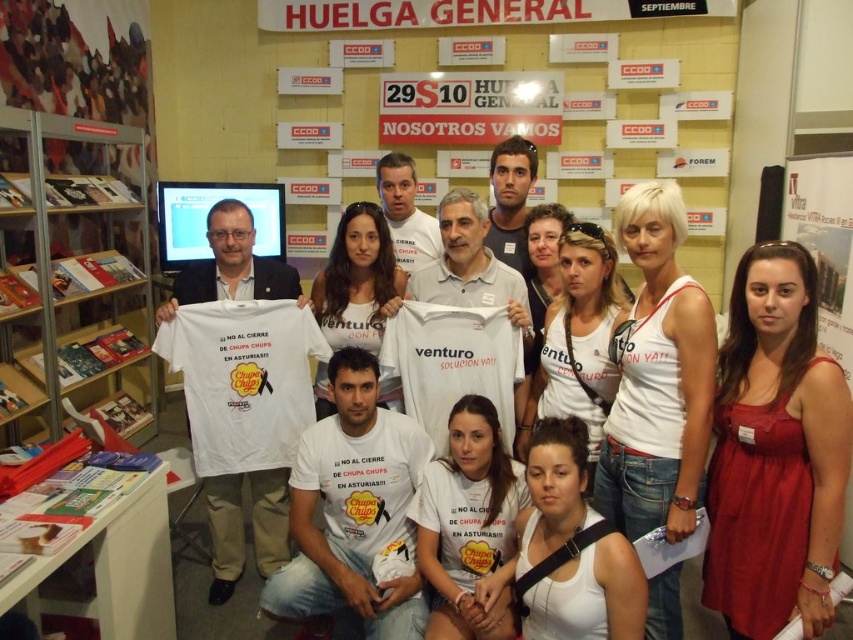
You are a photographer at this event and need to ensure that the metallic silver bookshelf at left is visible in the photo. Currently, the white cotton tank top at center is blocking it. Can you adjust the group to make the bookshelf visible without moving the bookshelf itself?

The white cotton tank top at center is in front of the metallic silver bookshelf at left, so moving the white cotton tank top at center backward or to the side would allow the bookshelf to become visible.

You are standing in front of the booth with the shelving units filled with books and pamphlets on the left side. You notice a white cotton tank top at center. Can you determine its exact location in the image using the coordinate system provided?

The white cotton tank top at center is located at point (657, 378) according to the coordinate system provided.